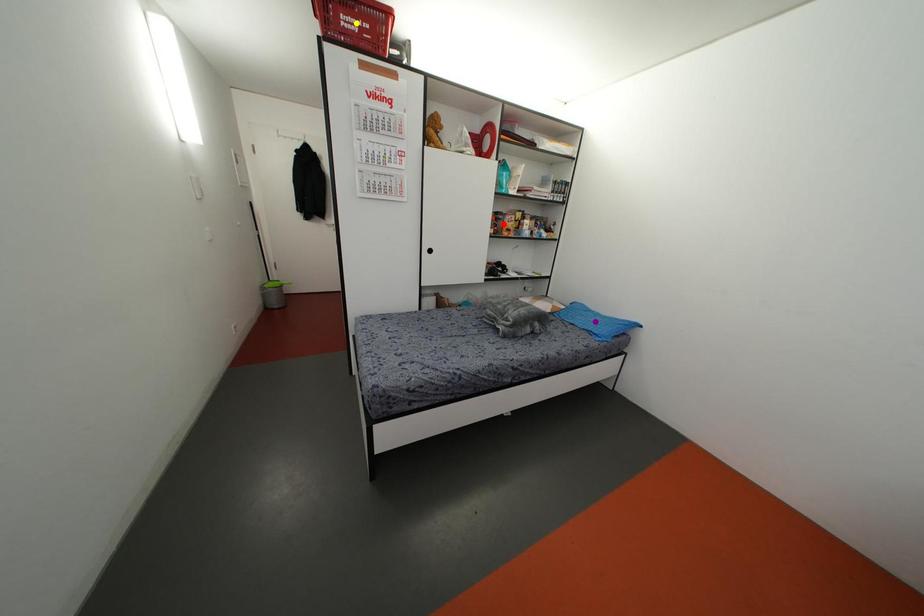
Order these from nearest to farthest:
purple point
red point
yellow point

yellow point, purple point, red point